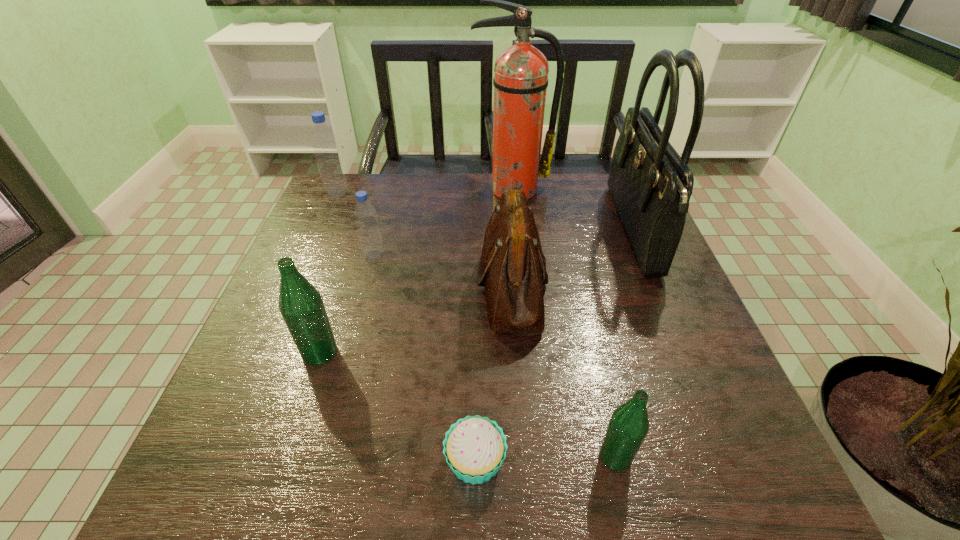
Find the location of a particular element. object at the far left corner is located at coordinates (324, 142).

The width and height of the screenshot is (960, 540). Find the location of `object that is at the far right corner`. object that is at the far right corner is located at coordinates (651, 185).

You are a GUI agent. You are given a task and a screenshot of the screen. Output one action in this format:
    pyautogui.click(x=<x>, y=<y>)
    Task: Click on the vacant space at the far edge of the desktop
    
    Given the screenshot: What is the action you would take?
    pyautogui.click(x=397, y=189)

You are a GUI agent. You are given a task and a screenshot of the screen. Output one action in this format:
    pyautogui.click(x=<x>, y=<y>)
    Task: Click on the free space at the near edge of the desktop
    The image size is (960, 540).
    Given the screenshot: What is the action you would take?
    pyautogui.click(x=645, y=482)

Identify the location of blank space at the left edge. (255, 368).

In the image, there is a desktop. Identify the location of vacant space at the right edge. The width and height of the screenshot is (960, 540). (616, 220).

Image resolution: width=960 pixels, height=540 pixels. What are the coordinates of `vacant space at the far left corner of the desktop` in the screenshot? It's located at (348, 180).

This screenshot has width=960, height=540. In the image, there is a desktop. What are the coordinates of `free space at the near right corner` in the screenshot? It's located at (734, 493).

This screenshot has width=960, height=540. Find the location of `vacant region between the white cupcake and the nearer green bottle`. vacant region between the white cupcake and the nearer green bottle is located at coordinates (545, 458).

Locate an element on the screen. free point between the brown shoulder bag and the rightmost bottle is located at coordinates (564, 371).